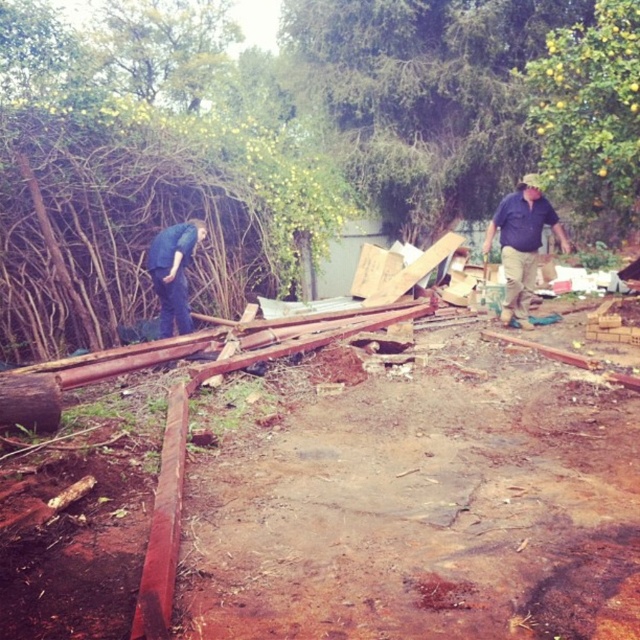
You are a worker at the construction site and you need to place a 1.5 meter ladder between the matte blue shirt at right and the blue jeans at left. Can you fit the ladder horizontally between them based on their heights?

The matte blue shirt at right is much taller than the blue jeans at left, so the vertical space between them may not be sufficient to fit a 1.5 meter ladder horizontally. The height difference suggests that the space between them might be narrower than 1.5 meters, making it difficult to place the ladder horizontally.

You are a worker at the construction site and need to determine which clothing item is bigger between the matte blue shirt at right and the blue jeans at left. Which one is larger?

The matte blue shirt at right is larger than the blue jeans at left.

You are a worker at the construction site and need to place a tool on the ground near the matte blue shirt at right. Based on the scene, where would you place the tool to ensure it stays stable?

The tool should be placed on the ground near the matte blue shirt at right, specifically on a flat wooden plank to ensure stability, as the ground is uneven and covered with dirt and scattered planks.